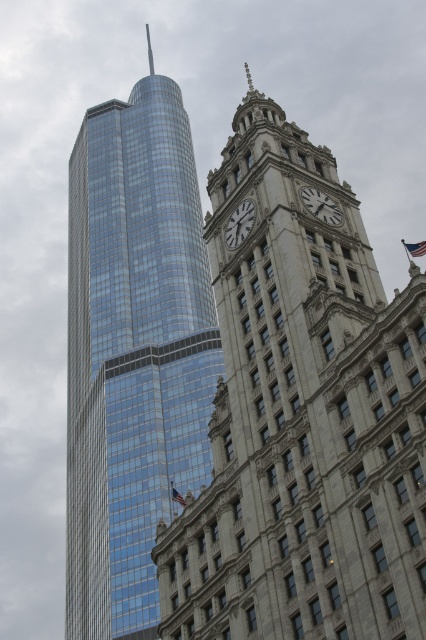
Question: Is white marble clock at upper center smaller than white stone clock at upper center?

Choices:
 (A) yes
 (B) no

Answer: (A)

Question: Which point is farther to the camera?

Choices:
 (A) (161, 477)
 (B) (319, 208)
 (C) (241, 154)
 (D) (233, 214)

Answer: (A)

Question: Which of the following is the farthest from the observer?

Choices:
 (A) (126, 298)
 (B) (325, 214)
 (C) (230, 230)
 (D) (264, 122)

Answer: (A)

Question: Is glassy steel skyscraper at center to the right of shiny glass skyscraper at left from the viewer's perspective?

Choices:
 (A) no
 (B) yes

Answer: (B)

Question: Is shiny glass skyscraper at left below white marble clock at upper center?

Choices:
 (A) no
 (B) yes

Answer: (A)

Question: Which object is positioned closest to the white stone clock at upper center?

Choices:
 (A) glassy steel skyscraper at center
 (B) white marble clock at upper center

Answer: (B)